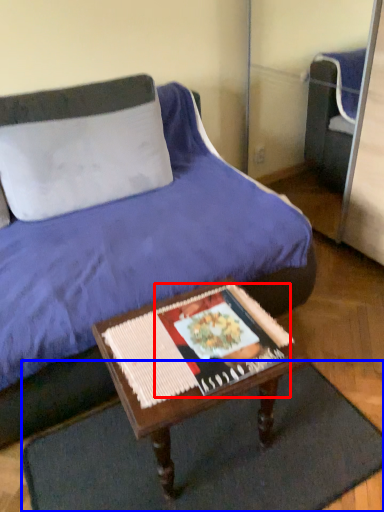
Question: Which object is closer to the camera taking this photo, magazine (highlighted by a red box) or doormat (highlighted by a blue box)?

Choices:
 (A) magazine
 (B) doormat

Answer: (B)